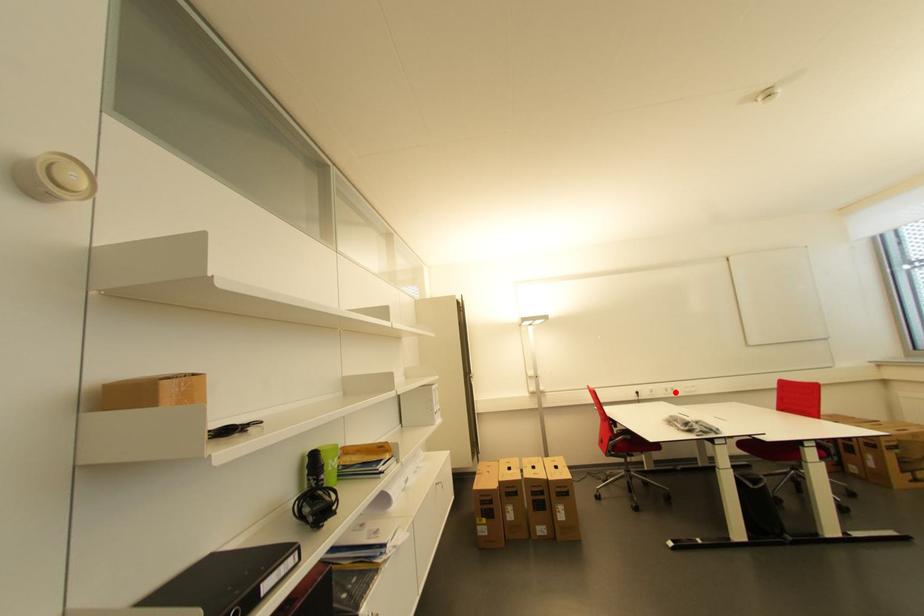
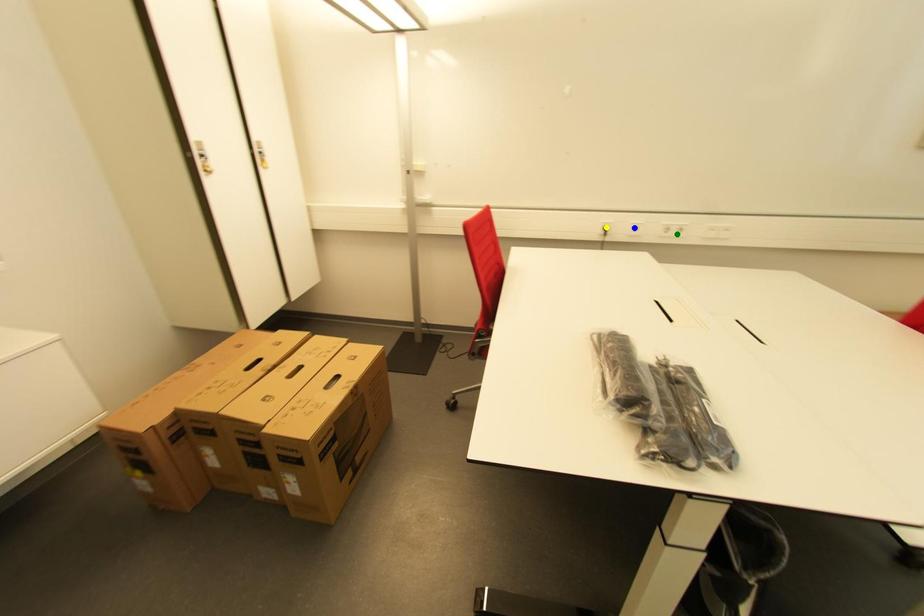
Question: I am providing you with two images of the same scene from different viewpoints. A red point is marked on the first image. You are given multiple points on the second image. Can you choose the point in image 2 that corresponds to the point in image 1?

Choices:
 (A) blue point
 (B) yellow point
 (C) green point

Answer: (C)